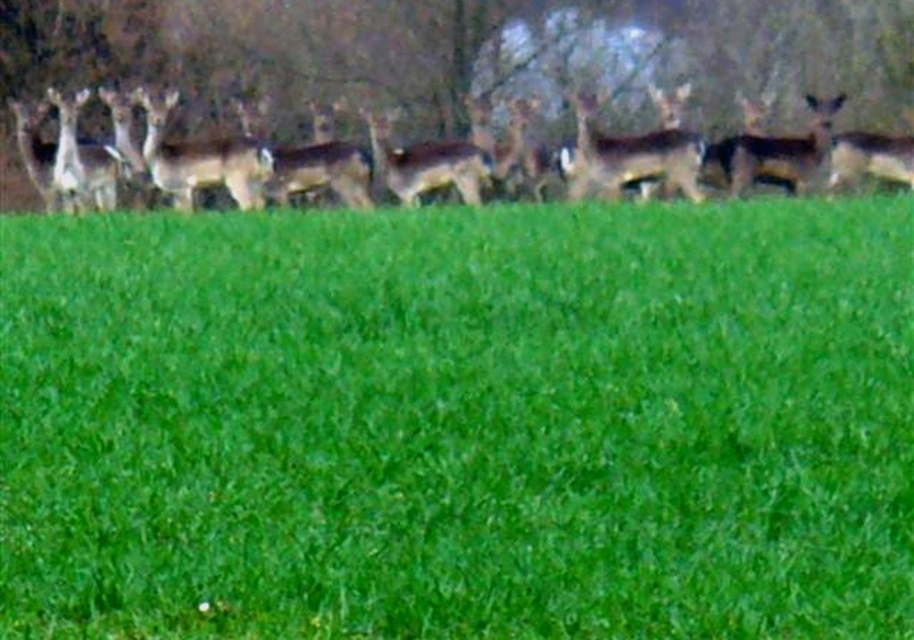
You are a hiker standing in the field and see the green grass at lower center and the brown matte deer at upper right. Which object is closer to you?

The green grass at lower center is closer to you because it is located below the brown matte deer at upper right, meaning it is positioned nearer in the scene.

From the picture: You are a wildlife photographer aiming to capture a closeup of the green grass at lower center. Your camera lens has a minimum focusing distance of 5 meters. Can you take the photo without moving closer than the required distance?

The green grass at lower center is 5.43 meters away, which is beyond the camera lens minimum focusing distance of 5 meters. Therefore, you can take the photo without moving closer than the required distance.